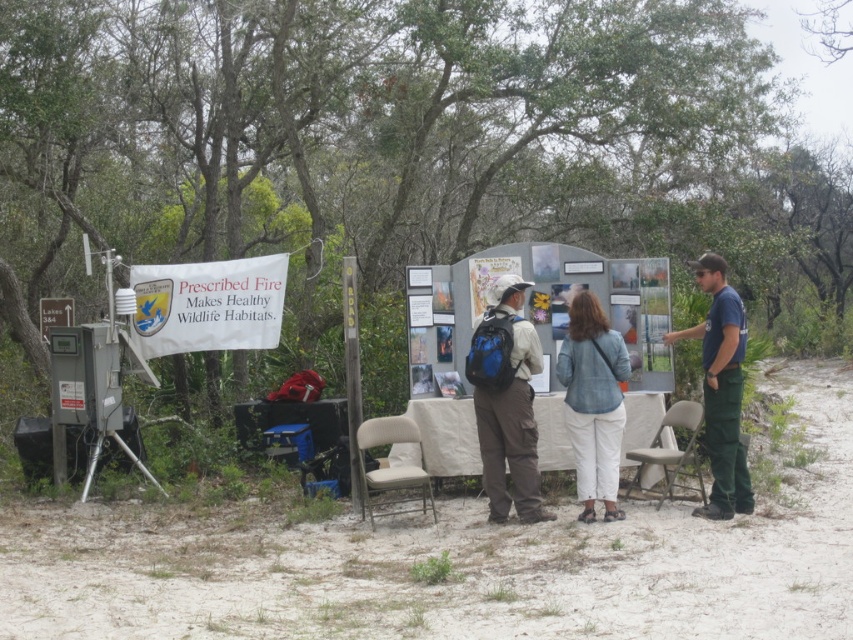
You are standing at the table in the educational setup. You see two points marked on the ground. The first point is at coordinates point (202, 618) and the second point is at point (612, 442). Which point is closer to you?

Point (202, 618) is in front of point (612, 442), so it is closer to you.

You are a visitor at the educational setup and want to take a photo of both the denim jacket at center and dark blue uniform at center. Which one should you focus on first to ensure both are in frame?

You should focus on the dark blue uniform at center first because the denim jacket at center is positioned under it, so adjusting the camera angle to include the dark blue uniform will naturally capture the denim jacket beneath it.